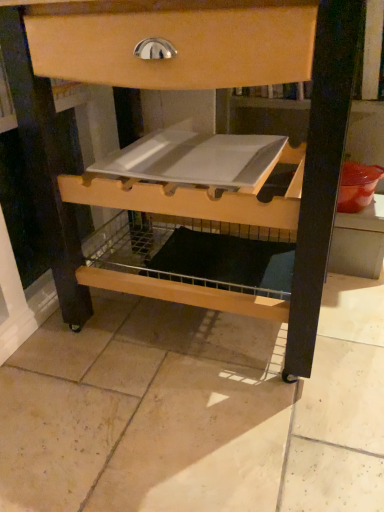
The width and height of the screenshot is (384, 512). In order to click on vacant space underneath matte white tray at center (from a real-world perspective) in this screenshot , I will do `click(196, 330)`.